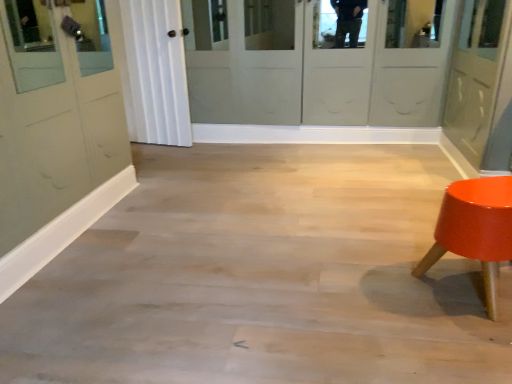
Where is `free area below shiny orange stool at right (from a real-world perspective)`? Image resolution: width=512 pixels, height=384 pixels. free area below shiny orange stool at right (from a real-world perspective) is located at coordinates (449, 292).